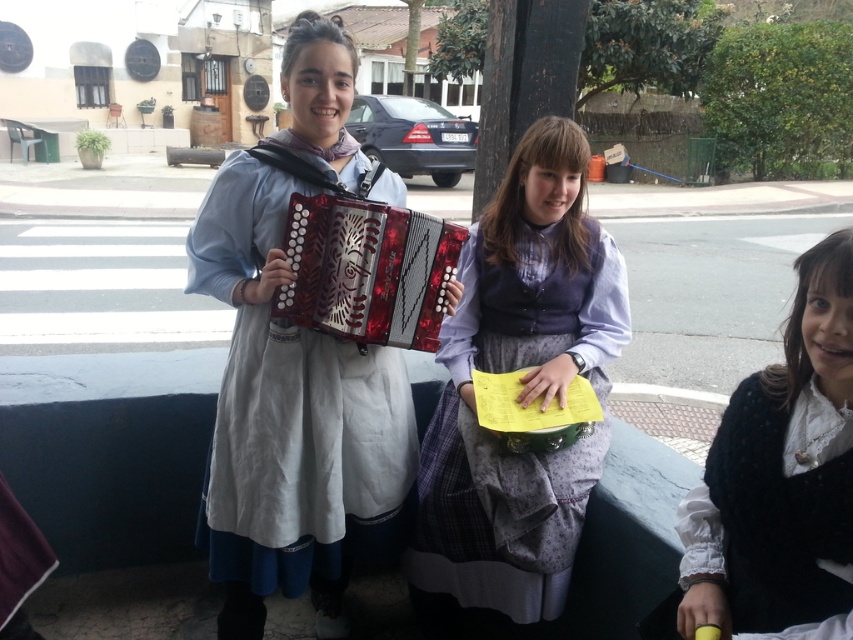
Is matte purple vest at center to the right of shiny red wood accordion at center from the viewer's perspective?

Yes, matte purple vest at center is to the right of shiny red wood accordion at center.

Looking at this image, which is above, matte purple vest at center or shiny red wood accordion at center?

Positioned higher is shiny red wood accordion at center.

Which is behind, point (474, 388) or point (381, 291)?

The point (474, 388) is behind.

At what (x,y) coordinates should I click in order to perform the action: click on matte purple vest at center. Please return your answer as a coordinate pair (x, y). The height and width of the screenshot is (640, 853). Looking at the image, I should click on (519, 392).

Which is above, black fuzzy sweater at lower right or shiny red wood accordion at center?

shiny red wood accordion at center is higher up.

Does black fuzzy sweater at lower right lie in front of shiny red wood accordion at center?

Yes, black fuzzy sweater at lower right is in front of shiny red wood accordion at center.

Is point (729, 538) more distant than point (302, 323)?

No, it is in front of (302, 323).

You are a GUI agent. You are given a task and a screenshot of the screen. Output one action in this format:
    pyautogui.click(x=<x>, y=<y>)
    Task: Click on the black fuzzy sweater at lower right
    This screenshot has height=640, width=853.
    Given the screenshot: What is the action you would take?
    pyautogui.click(x=781, y=477)

Consider the image. Is matte black accordion at center to the right of matte purple vest at center from the viewer's perspective?

In fact, matte black accordion at center is to the left of matte purple vest at center.

Does matte black accordion at center appear on the left side of matte purple vest at center?

Indeed, matte black accordion at center is positioned on the left side of matte purple vest at center.

I want to click on matte black accordion at center, so click(296, 368).